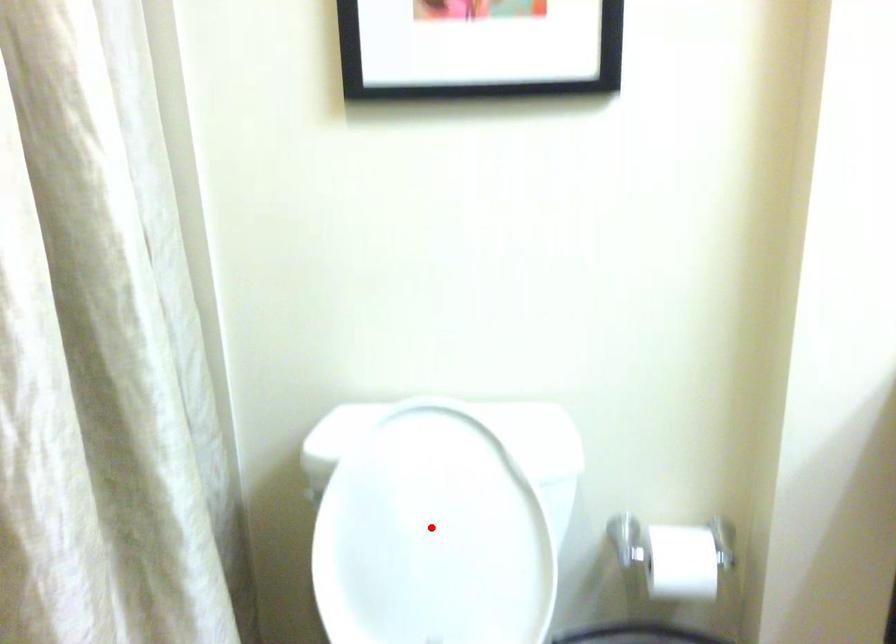
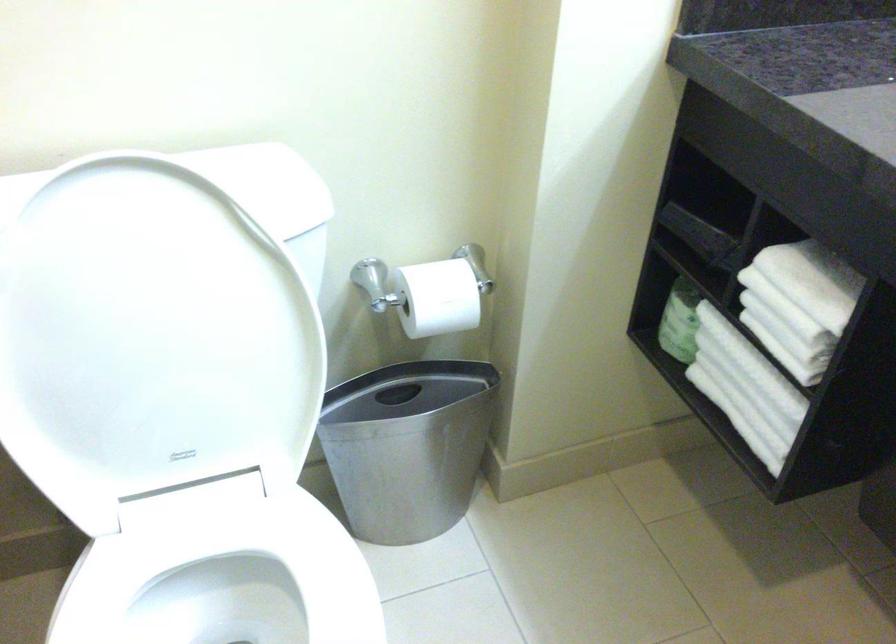
Locate, in the second image, the point that corresponds to the highlighted location in the first image.

(159, 323)